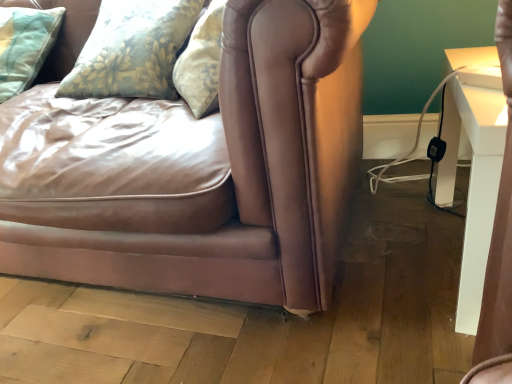
Question: Is light blue quilted pillow at upper left, acting as the first pillow starting from the left, closer to the viewer compared to white glossy table at right?

Choices:
 (A) yes
 (B) no

Answer: (B)

Question: Are light blue quilted pillow at upper left, acting as the first pillow starting from the left, and white glossy table at right making contact?

Choices:
 (A) no
 (B) yes

Answer: (A)

Question: Would you say light blue quilted pillow at upper left, acting as the second pillow starting from the right, is outside white glossy table at right?

Choices:
 (A) no
 (B) yes

Answer: (B)

Question: Is light blue quilted pillow at upper left, acting as the first pillow starting from the left, taller than white glossy table at right?

Choices:
 (A) yes
 (B) no

Answer: (B)

Question: Is light blue quilted pillow at upper left, acting as the second pillow starting from the right, surrounding white glossy table at right?

Choices:
 (A) yes
 (B) no

Answer: (B)

Question: Is light blue quilted pillow at upper left, acting as the first pillow starting from the left, positioned with its back to white glossy table at right?

Choices:
 (A) no
 (B) yes

Answer: (A)

Question: Does matte brown leather couch at center turn towards light blue quilted pillow at upper left, acting as the second pillow starting from the right?

Choices:
 (A) no
 (B) yes

Answer: (B)

Question: From a real-world perspective, is matte brown leather couch at center on light blue quilted pillow at upper left, acting as the second pillow starting from the right?

Choices:
 (A) no
 (B) yes

Answer: (A)

Question: Is matte brown leather couch at center completely or partially outside of light blue quilted pillow at upper left, acting as the second pillow starting from the right?

Choices:
 (A) no
 (B) yes

Answer: (B)

Question: Can you see matte brown leather couch at center touching light blue quilted pillow at upper left, acting as the first pillow starting from the left?

Choices:
 (A) no
 (B) yes

Answer: (A)

Question: Is matte brown leather couch at center further to camera compared to light blue quilted pillow at upper left, acting as the first pillow starting from the left?

Choices:
 (A) no
 (B) yes

Answer: (A)

Question: Is matte brown leather couch at center at the right side of light blue quilted pillow at upper left, acting as the second pillow starting from the right?

Choices:
 (A) no
 (B) yes

Answer: (B)

Question: Can you confirm if floral fabric pillow at upper left, arranged as the second pillow when viewed from the left, is thinner than matte brown leather couch at center?

Choices:
 (A) no
 (B) yes

Answer: (B)